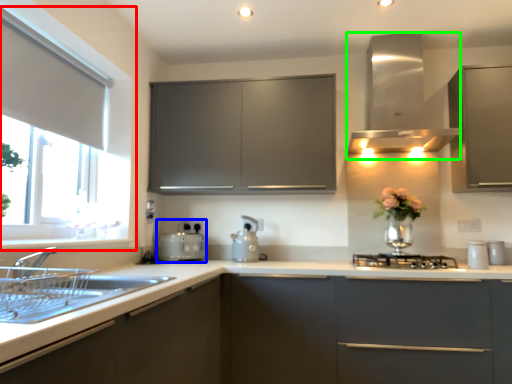
Question: Considering the real-world distances, which object is farthest from window (highlighted by a red box)? appliance (highlighted by a blue box) or vent (highlighted by a green box)?

Choices:
 (A) appliance
 (B) vent

Answer: (B)